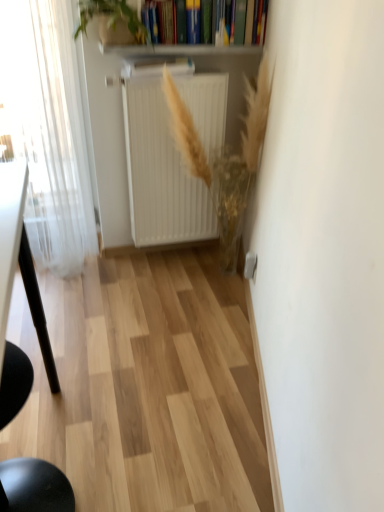
Question: From the image's perspective, is white glossy radiator at upper center located above golden textured plant at center, acting as the first plant starting from the right?

Choices:
 (A) yes
 (B) no

Answer: (A)

Question: Is white glossy radiator at upper center further to the viewer compared to golden textured plant at center, arranged as the 1th plant when ordered from the bottom?

Choices:
 (A) yes
 (B) no

Answer: (A)

Question: Does white glossy radiator at upper center have a smaller size compared to golden textured plant at center, positioned as the second plant in left-to-right order?

Choices:
 (A) yes
 (B) no

Answer: (A)

Question: Is white glossy radiator at upper center bigger than golden textured plant at center, acting as the first plant starting from the right?

Choices:
 (A) no
 (B) yes

Answer: (A)

Question: Can you confirm if white glossy radiator at upper center is wider than golden textured plant at center, arranged as the 1th plant when ordered from the bottom?

Choices:
 (A) no
 (B) yes

Answer: (A)

Question: Does white glossy radiator at upper center touch golden textured plant at center, positioned as the second plant in left-to-right order?

Choices:
 (A) no
 (B) yes

Answer: (A)

Question: Is white matte radiator at center taller than black matte chair at lower left?

Choices:
 (A) no
 (B) yes

Answer: (B)

Question: Could you tell me if white matte radiator at center is facing black matte chair at lower left?

Choices:
 (A) no
 (B) yes

Answer: (A)

Question: Is white matte radiator at center wider than black matte chair at lower left?

Choices:
 (A) yes
 (B) no

Answer: (B)

Question: Is the depth of white matte radiator at center greater than that of black matte chair at lower left?

Choices:
 (A) no
 (B) yes

Answer: (B)

Question: From a real-world perspective, does white matte radiator at center sit lower than black matte chair at lower left?

Choices:
 (A) no
 (B) yes

Answer: (A)

Question: Considering the relative sizes of white matte radiator at center and black matte chair at lower left in the image provided, is white matte radiator at center shorter than black matte chair at lower left?

Choices:
 (A) yes
 (B) no

Answer: (B)

Question: From the image's perspective, is white matte radiator at center on top of white sheer curtain at left?

Choices:
 (A) no
 (B) yes

Answer: (A)